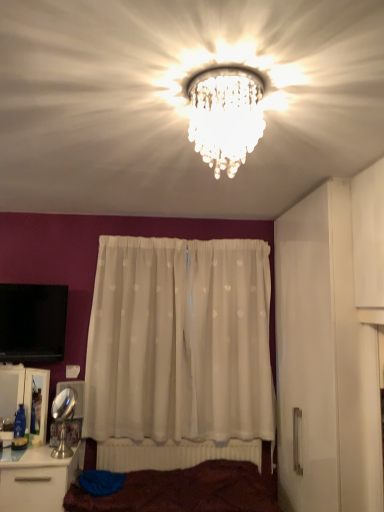
The image size is (384, 512). I want to click on free point above white plastic radiator at lower center (from a real-world perspective), so click(x=185, y=438).